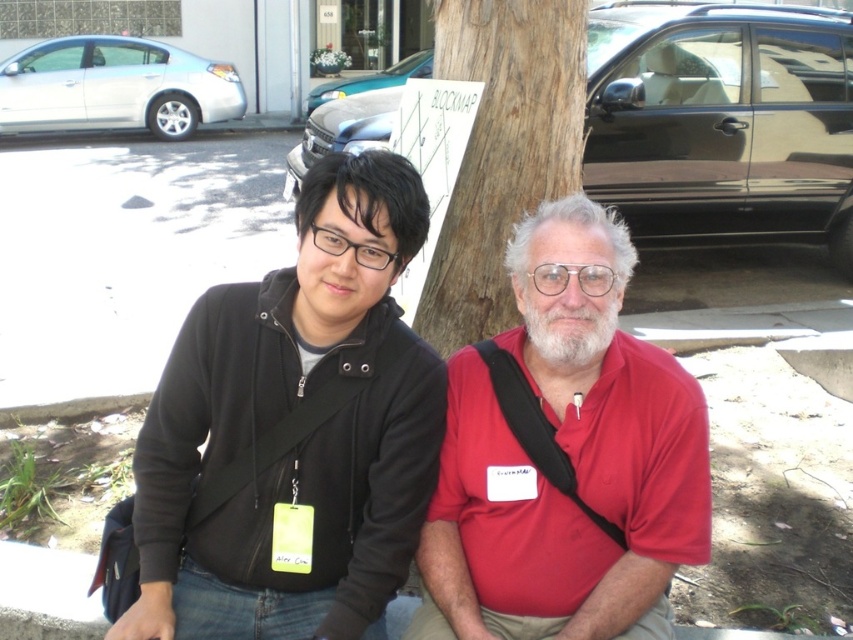
Which of these two, red matte shirt at center or brown textured tree trunk at center, stands shorter?

red matte shirt at center

In the scene shown: Is red matte shirt at center above brown textured tree trunk at center?

No.

Measure the distance between red matte shirt at center and camera.

A distance of 5.37 feet exists between red matte shirt at center and camera.

This screenshot has width=853, height=640. I want to click on red matte shirt at center, so click(x=564, y=456).

Does matte black jacket at center have a lesser width compared to red matte shirt at center?

No.

Who is positioned more to the left, matte black jacket at center or red matte shirt at center?

From the viewer's perspective, matte black jacket at center appears more on the left side.

Is point (590, 476) less distant than point (456, 435)?

Yes, point (590, 476) is closer to viewer.

Locate an element on the screen. The width and height of the screenshot is (853, 640). matte black jacket at center is located at coordinates (566, 458).

The width and height of the screenshot is (853, 640). Describe the element at coordinates (566, 458) in the screenshot. I see `matte black jacket at center` at that location.

Can you confirm if matte black jacket at center is bigger than brown textured tree trunk at center?

Indeed, matte black jacket at center has a larger size compared to brown textured tree trunk at center.

Is point (438, 472) positioned before point (514, 305)?

Yes, point (438, 472) is in front of point (514, 305).

The width and height of the screenshot is (853, 640). Find the location of `matte black jacket at center`. matte black jacket at center is located at coordinates (566, 458).